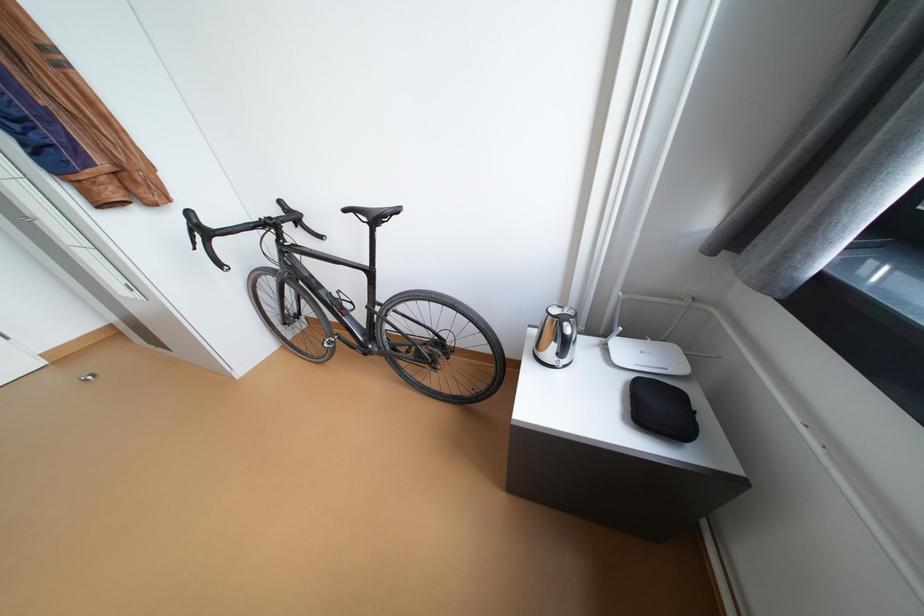
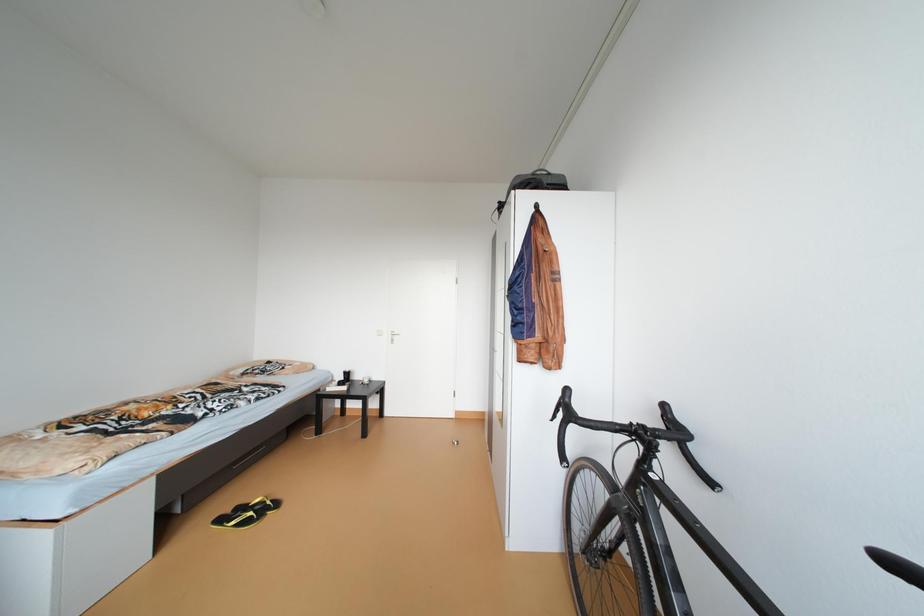
Question: The camera is either moving clockwise (left) or counter-clockwise (right) around the object. The first image is from the beginning of the video and the second image is from the end. Is the camera moving left or right when shooting the video?

Choices:
 (A) Left
 (B) Right

Answer: (B)